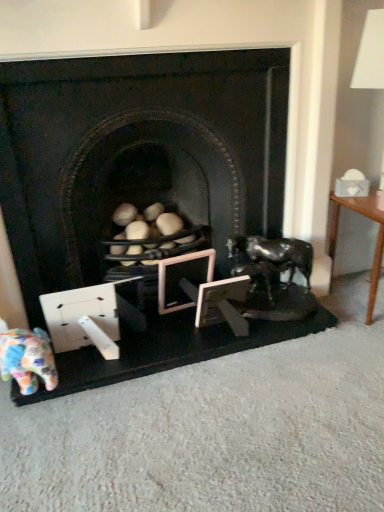
The width and height of the screenshot is (384, 512). What are the coordinates of `vacant area that lies to the right of wooden picture frame at center, acting as the 2th picture frame starting from the left` in the screenshot? It's located at (265, 323).